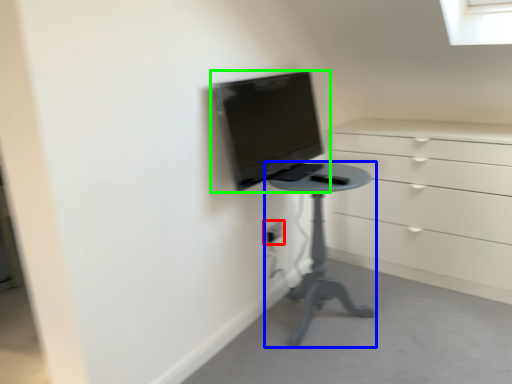
Question: Which object is the farthest from electric outlet (highlighted by a red box)? Choose among these: furniture (highlighted by a blue box) or computer monitor (highlighted by a green box).

Choices:
 (A) furniture
 (B) computer monitor

Answer: (B)